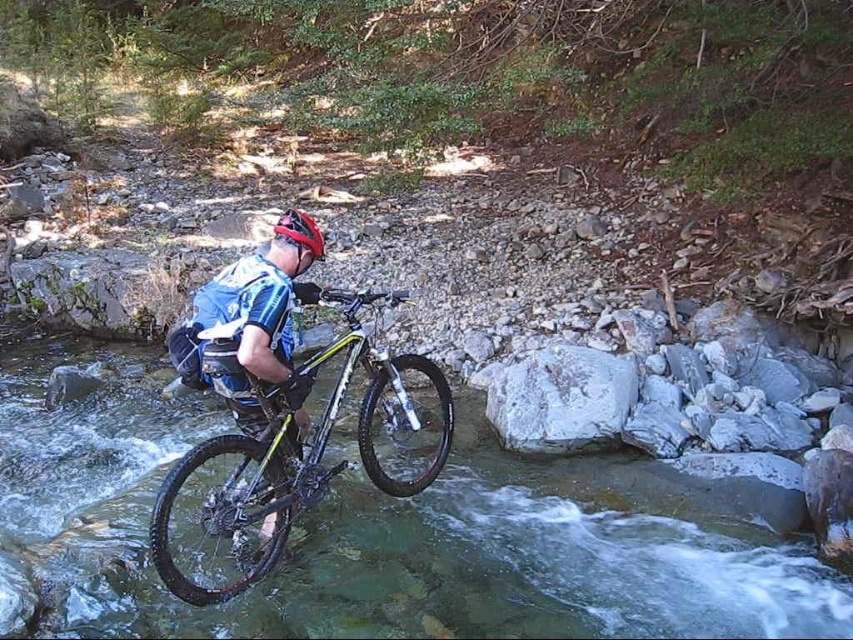
Question: Does clear water at center appear over yellow matte bicycle at center?

Choices:
 (A) yes
 (B) no

Answer: (B)

Question: Which point is farther to the camera?

Choices:
 (A) yellow matte bicycle at center
 (B) red matte bicycle helmet at center
 (C) white smooth rock at center
 (D) clear water at center

Answer: (D)

Question: Does yellow matte bicycle at center appear on the right side of red matte bicycle helmet at center?

Choices:
 (A) yes
 (B) no

Answer: (A)

Question: Can you confirm if clear water at center is smaller than white smooth rock at center?

Choices:
 (A) yes
 (B) no

Answer: (B)

Question: Which object is the farthest from the red matte bicycle helmet at center?

Choices:
 (A) clear water at center
 (B) white smooth rock at center
 (C) yellow matte bicycle at center

Answer: (A)

Question: Which point is closer to the camera?

Choices:
 (A) (292, 228)
 (B) (532, 397)
 (C) (28, 464)
 (D) (219, 586)

Answer: (D)